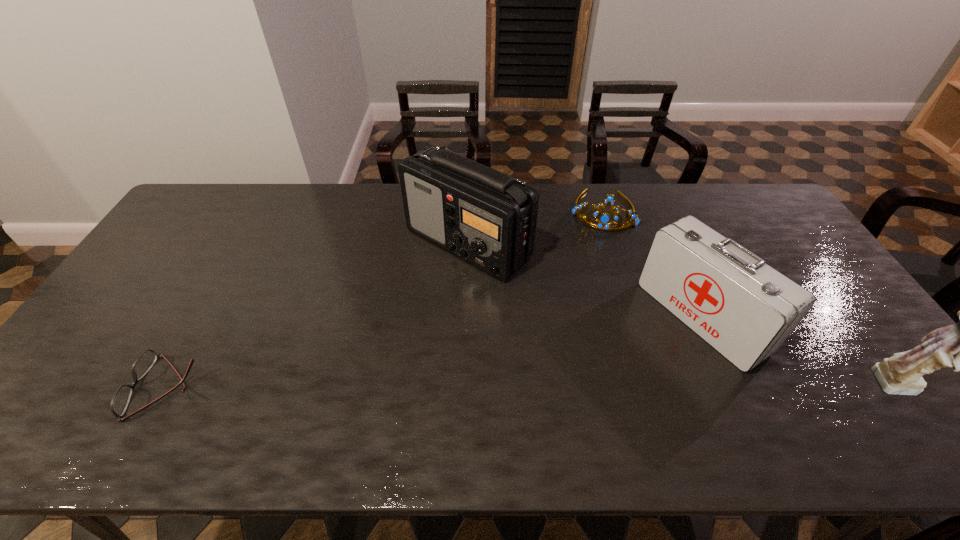
Where is `vacant space on the desktop that is between the spectacles and the rightmost object and is positioned on the front-facing side of the first-aid kit`? The height and width of the screenshot is (540, 960). vacant space on the desktop that is between the spectacles and the rightmost object and is positioned on the front-facing side of the first-aid kit is located at coordinates (588, 387).

The image size is (960, 540). I want to click on vacant space on the desktop that is between the shortest object and the rightmost object and is positioned on the front-facing side of the fourth tallest object, so click(x=568, y=387).

You are a GUI agent. You are given a task and a screenshot of the screen. Output one action in this format:
    pyautogui.click(x=<x>, y=<y>)
    Task: Click on the free spot on the desktop that is between the leftmost object and the rightmost object and is positioned on the front panel of the radio receiver
    This screenshot has width=960, height=540.
    Given the screenshot: What is the action you would take?
    pyautogui.click(x=430, y=387)